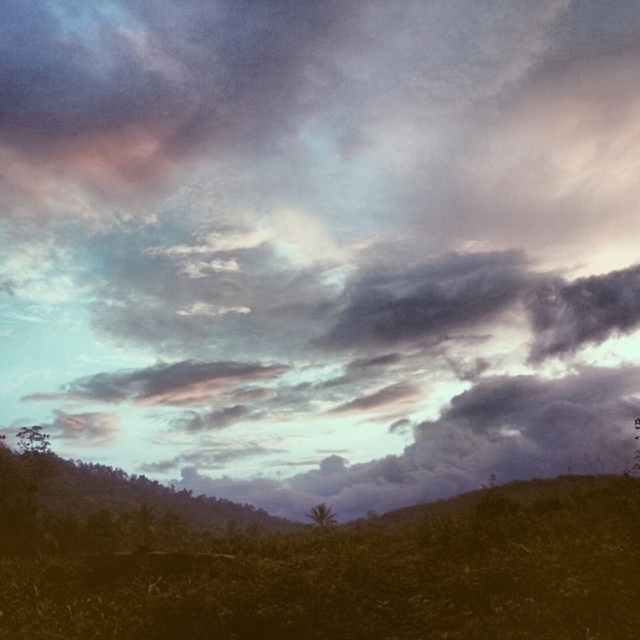
Is green leafy tree at lower left to the right of green leafy tree at center from the viewer's perspective?

Incorrect, green leafy tree at lower left is not on the right side of green leafy tree at center.

What do you see at coordinates (33, 440) in the screenshot?
I see `green leafy tree at lower left` at bounding box center [33, 440].

This screenshot has width=640, height=640. I want to click on green leafy tree at lower left, so click(x=33, y=440).

Find the location of a particular element. This screenshot has width=640, height=640. green leafy tree at lower left is located at coordinates (33, 440).

Between green grassy field at lower center and green leafy tree at center, which one appears on the right side from the viewer's perspective?

green leafy tree at center is more to the right.

Does green grassy field at lower center have a larger size compared to green leafy tree at center?

Yes, green grassy field at lower center is bigger than green leafy tree at center.

Which is behind, point (180, 556) or point (324, 512)?

The point (324, 512) is more distant.

You are a GUI agent. You are given a task and a screenshot of the screen. Output one action in this format:
    pyautogui.click(x=<x>, y=<y>)
    Task: Click on the green grassy field at lower center
    The image size is (640, 640).
    Given the screenshot: What is the action you would take?
    pyautogui.click(x=364, y=577)

Who is taller, green grassy field at lower center or green leafy tree at lower left?

Standing taller between the two is green grassy field at lower center.

Between point (624, 602) and point (38, 436), which one is positioned behind?

The point (38, 436) is more distant.

Describe the element at coordinates (364, 577) in the screenshot. The width and height of the screenshot is (640, 640). I see `green grassy field at lower center` at that location.

Find the location of a particular element. Image resolution: width=640 pixels, height=640 pixels. green grassy field at lower center is located at coordinates (364, 577).